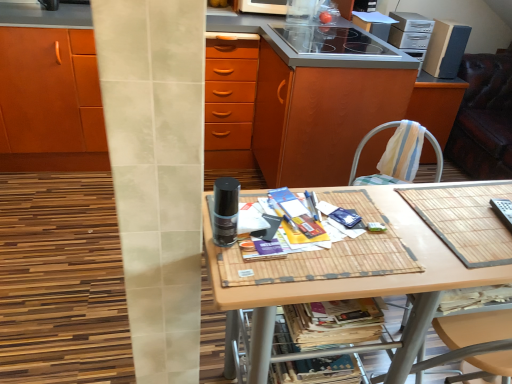
Where is `vacant space to the left of black plastic remote control at right, acting as the first appliance starting from the bottom`? The height and width of the screenshot is (384, 512). vacant space to the left of black plastic remote control at right, acting as the first appliance starting from the bottom is located at coordinates (465, 231).